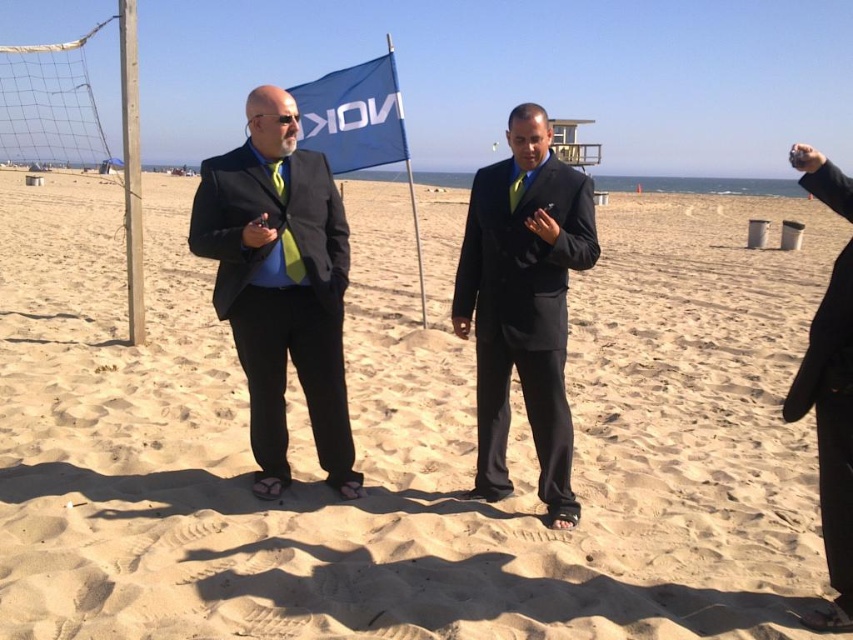
You are a photographer at the beach scene. You need to position a 2m tall tripod between the black matte suit at right and the blue fabric flag at center so that it is visible to both subjects. Can the tripod be placed in such a way that it doesn

The black matte suit at right is taller than the blue fabric flag at center. Since the tripod is 2m tall, it can be positioned between them as long as it doesn

You are a photographer at the beach scene described. You need to position a tripod so it is between the matte black suit at left and the blue fabric flag at center. Is the space between them sufficient for the tripod?

The matte black suit at left is located below the blue fabric flag at center, so the vertical space between them may be sufficient for the tripod depending on its height requirements.

You are a photographer at the beach scene. You need to position a new tripod between the black matte suit at right and the blue fabric flag at center. Based on their positions, which object should the tripod be closer to?

The black matte suit at right is to the right of the blue fabric flag at center, so the tripod should be placed closer to the blue fabric flag at center to be between them.